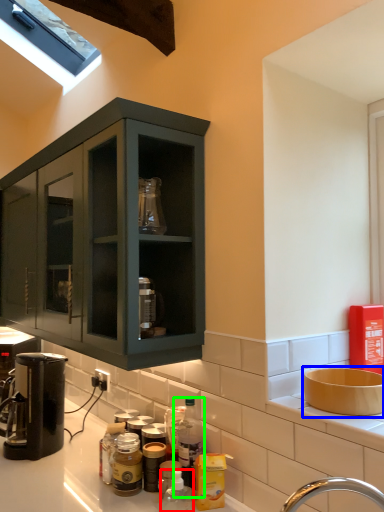
Question: Which object is the farthest from bottle (highlighted by a red box)? Choose among these: sink (highlighted by a blue box) or bottle (highlighted by a green box).

Choices:
 (A) sink
 (B) bottle

Answer: (A)